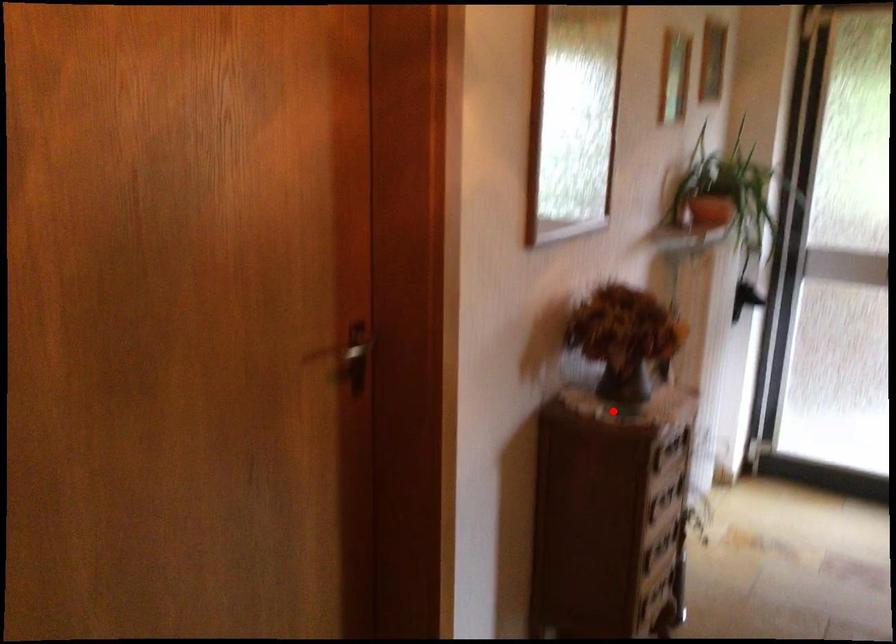
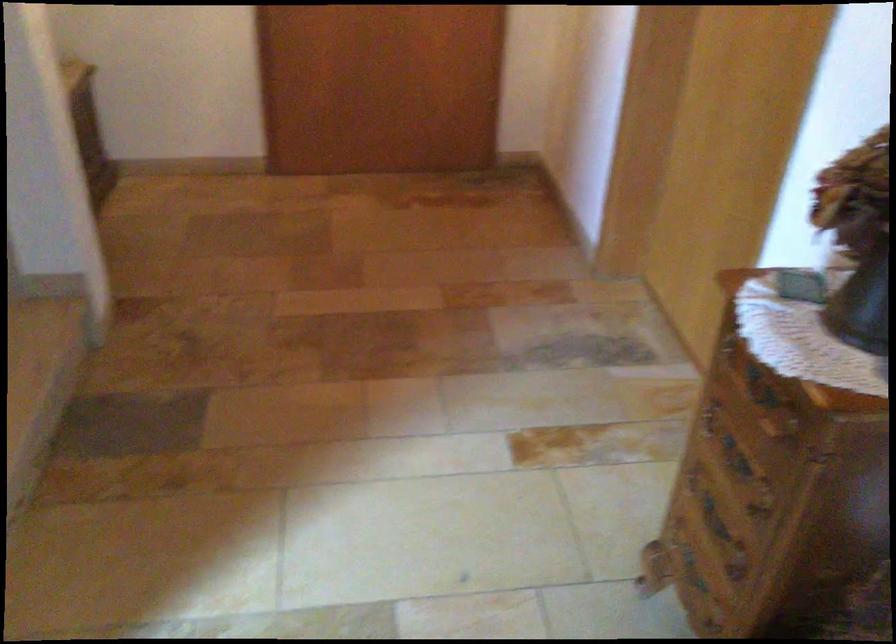
Question: I am providing you with two images of the same scene from different viewpoints. In image1, a red point is highlighted. Considering the same 3D point in image2, which of the following is correct?

Choices:
 (A) It is closer
 (B) It is farther

Answer: (A)